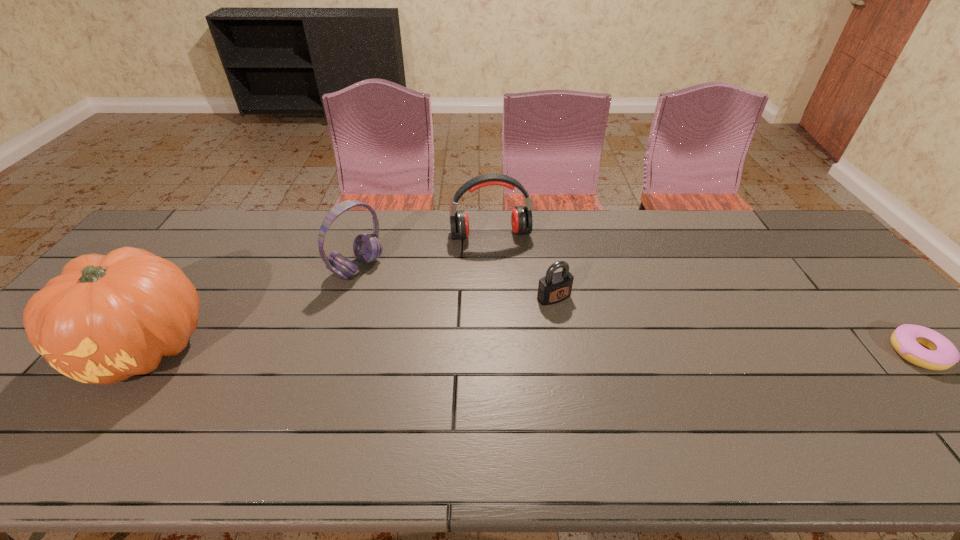
This screenshot has height=540, width=960. In order to click on vacant space at the near edge of the desktop in this screenshot , I will do `click(805, 409)`.

Find the location of `free space at the right edge of the desktop`. free space at the right edge of the desktop is located at coordinates (855, 326).

Image resolution: width=960 pixels, height=540 pixels. I want to click on free space at the far right corner, so pyautogui.click(x=793, y=221).

What are the coordinates of `vacant space at the near right corner of the desktop` in the screenshot? It's located at (937, 404).

The height and width of the screenshot is (540, 960). I want to click on vacant area that lies between the farthest object and the leftmost object, so click(x=319, y=291).

This screenshot has width=960, height=540. Find the location of `free point between the leftmost object and the fourth tallest object`. free point between the leftmost object and the fourth tallest object is located at coordinates click(350, 322).

This screenshot has height=540, width=960. What are the coordinates of `vacant region between the fourth nearest object and the pumpkin` in the screenshot? It's located at (252, 307).

This screenshot has height=540, width=960. I want to click on vacant area that lies between the leftmost object and the second farthest object, so click(x=252, y=307).

Identify the location of free point between the farthest object and the second shortest object. Image resolution: width=960 pixels, height=540 pixels. (522, 266).

Where is `free space between the leftmost object and the earphone`? free space between the leftmost object and the earphone is located at coordinates (319, 291).